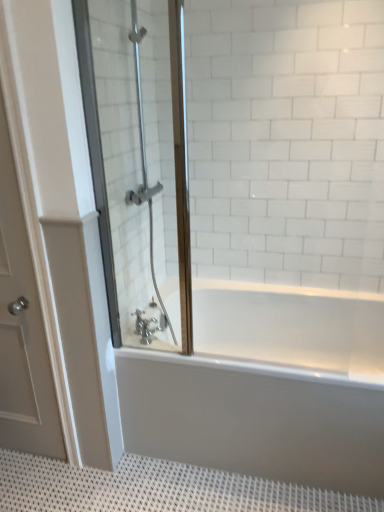
Question: Is the depth of white glossy bathtub at center less than that of white textured bath mat at lower center?

Choices:
 (A) yes
 (B) no

Answer: (B)

Question: Is white glossy bathtub at center smaller than white textured bath mat at lower center?

Choices:
 (A) yes
 (B) no

Answer: (B)

Question: Could you tell me if white glossy bathtub at center is turned towards white textured bath mat at lower center?

Choices:
 (A) no
 (B) yes

Answer: (B)

Question: Does white glossy bathtub at center have a lesser height compared to white textured bath mat at lower center?

Choices:
 (A) yes
 (B) no

Answer: (B)

Question: From a real-world perspective, is white glossy bathtub at center below white textured bath mat at lower center?

Choices:
 (A) no
 (B) yes

Answer: (A)

Question: In the image, is white textured bath mat at lower center positioned in front of or behind white glossy bathtub at center?

Choices:
 (A) behind
 (B) front

Answer: (B)

Question: Looking at their shapes, would you say white textured bath mat at lower center is wider or thinner than white glossy bathtub at center?

Choices:
 (A) thin
 (B) wide

Answer: (B)

Question: From the image's perspective, is white textured bath mat at lower center located above or below white glossy bathtub at center?

Choices:
 (A) below
 (B) above

Answer: (A)

Question: Looking at the image, does white textured bath mat at lower center seem bigger or smaller compared to white glossy bathtub at center?

Choices:
 (A) small
 (B) big

Answer: (A)

Question: Based on their positions, is clear glass shower door at left located to the left or right of white glossy bathtub at center?

Choices:
 (A) left
 (B) right

Answer: (A)

Question: Would you say clear glass shower door at left is inside or outside white glossy bathtub at center?

Choices:
 (A) inside
 (B) outside

Answer: (B)

Question: Is point (77, 44) closer or farther from the camera than point (201, 422)?

Choices:
 (A) farther
 (B) closer

Answer: (B)

Question: In the image, is clear glass shower door at left positioned in front of or behind white glossy bathtub at center?

Choices:
 (A) behind
 (B) front

Answer: (B)

Question: Is white matte door at left wider or thinner than white textured bath mat at lower center?

Choices:
 (A) wide
 (B) thin

Answer: (B)

Question: Do you think white matte door at left is within white textured bath mat at lower center, or outside of it?

Choices:
 (A) outside
 (B) inside

Answer: (A)